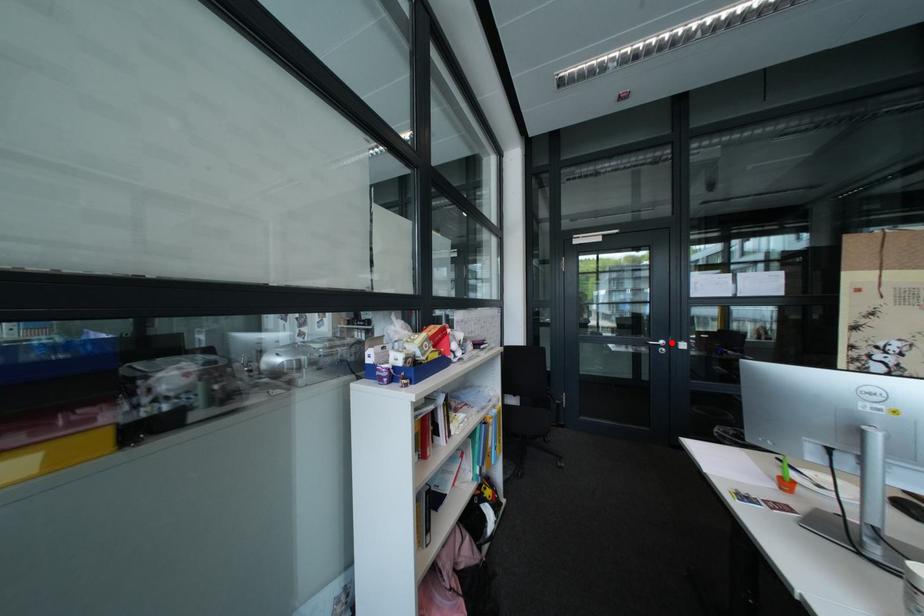
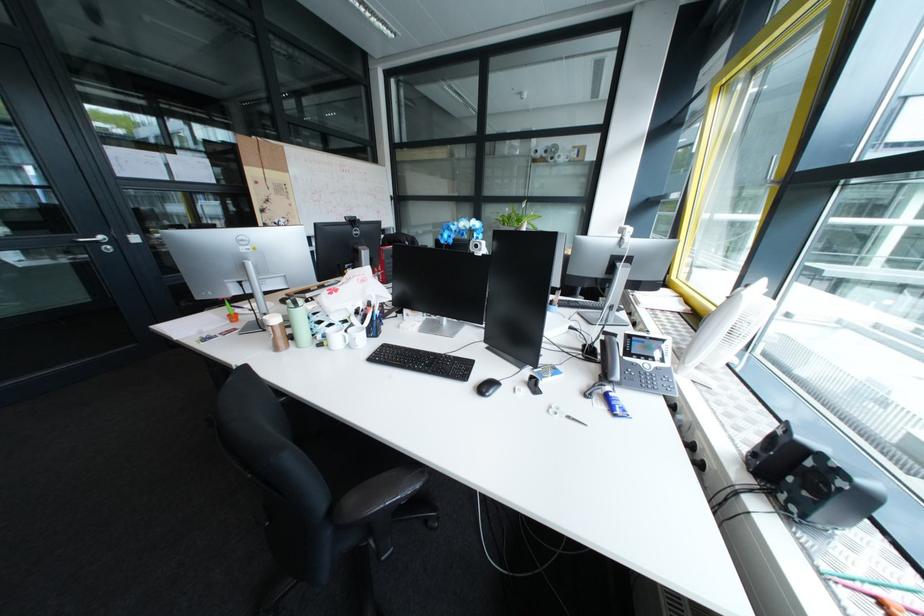
In the second image, find the point that corresponds to the highlighted location in the first image.

(107, 238)